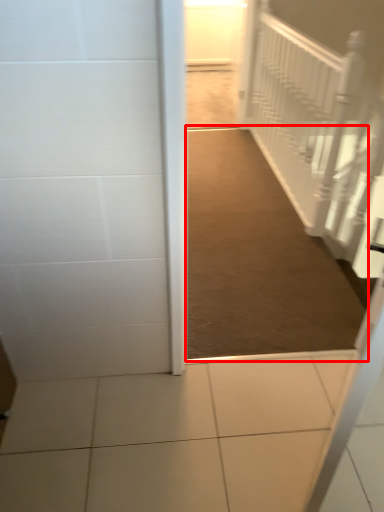
Question: From the image, what is the correct spatial relationship of path (annotated by the red box) in relation to stairwell?

Choices:
 (A) right
 (B) left

Answer: (B)